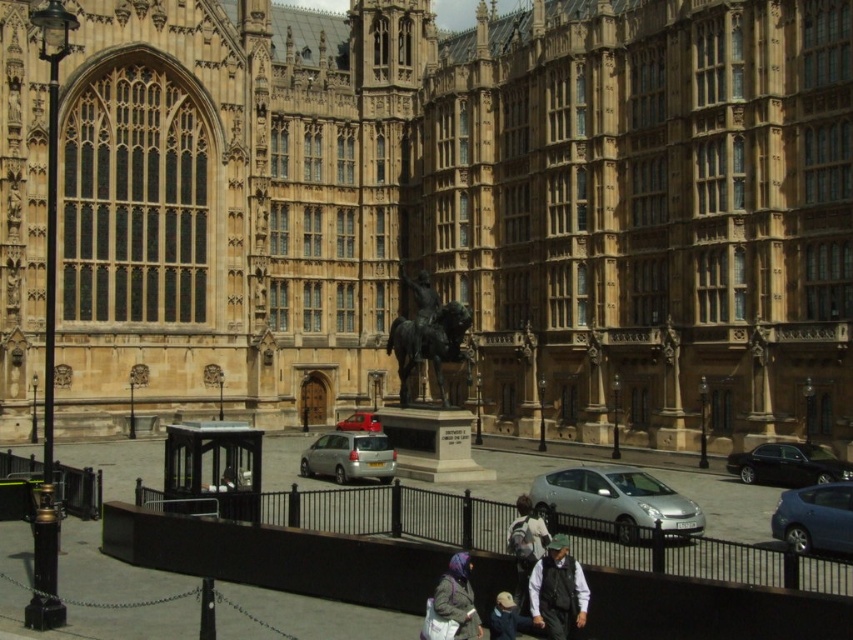
You are a photographer planning to take a photo of the light brown leather jacket at lower center and the satin silver car at center. You want to ensure both are visible in the frame. Based on their positions, which object should you place on the left side of your camera frame to include both?

The satin silver car at center is positioned on the left side of light brown leather jacket at lower center, so to include both in the frame, you should place the satin silver car at center on the left side of your camera frame and the light brown leather jacket at lower center on the right side.

You are a tour guide explaining the scene to visitors. You mention both the blue metallic hatchback at lower right and the bronze statue at center. Which one is wider?

The blue metallic hatchback at lower right is wider than the bronze statue at center because the blue metallic hatchback at lower right has a greater width according to the description.

You are a tour guide explaining the historic building to visitors. You point to the bronze statue at center and the light brown leather jacket at lower center. Which object is closer to the visitors?

The bronze statue at center is closer to the visitors than the light brown leather jacket at lower center because it is further to the viewer.